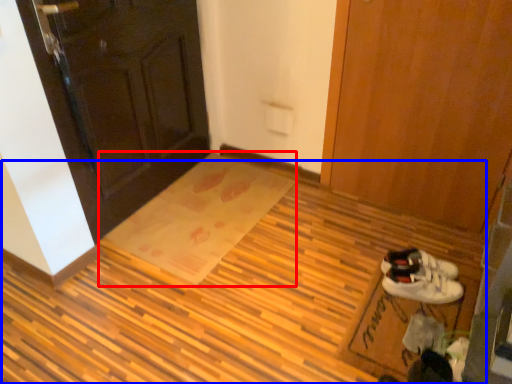
Question: Which object is further to the camera taking this photo, doormat (highlighted by a red box) or plywood (highlighted by a blue box)?

Choices:
 (A) doormat
 (B) plywood

Answer: (A)